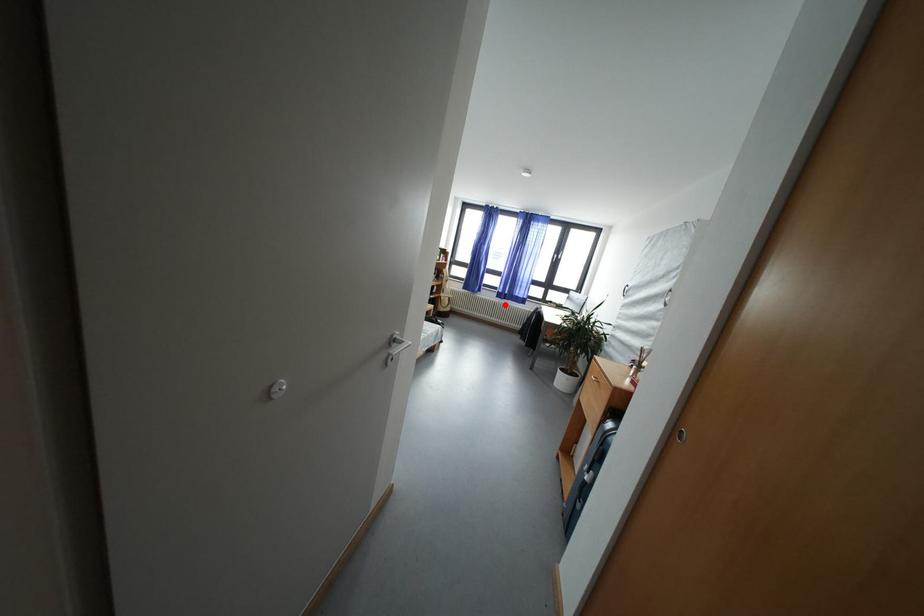
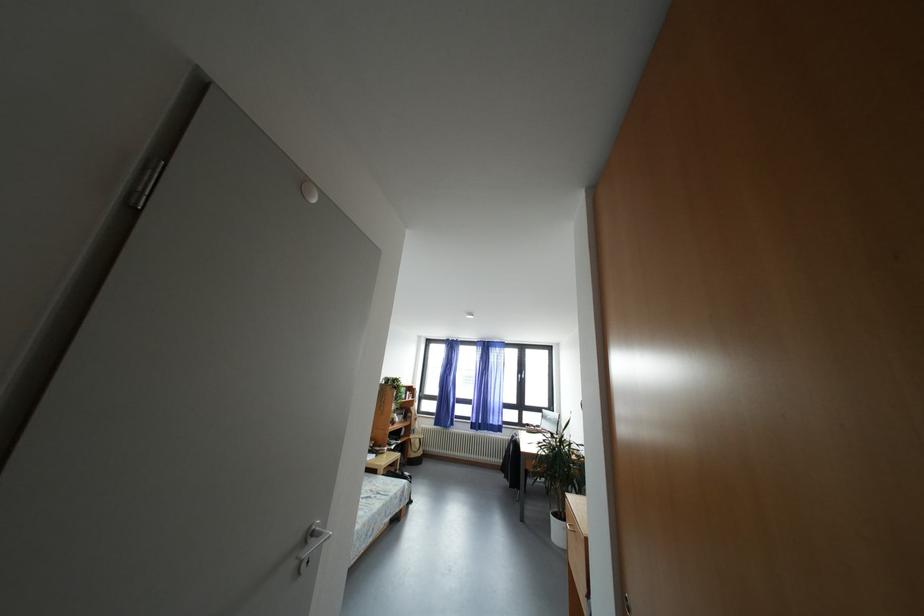
In the second image, find the point that corresponds to the highlighted location in the first image.

(480, 437)